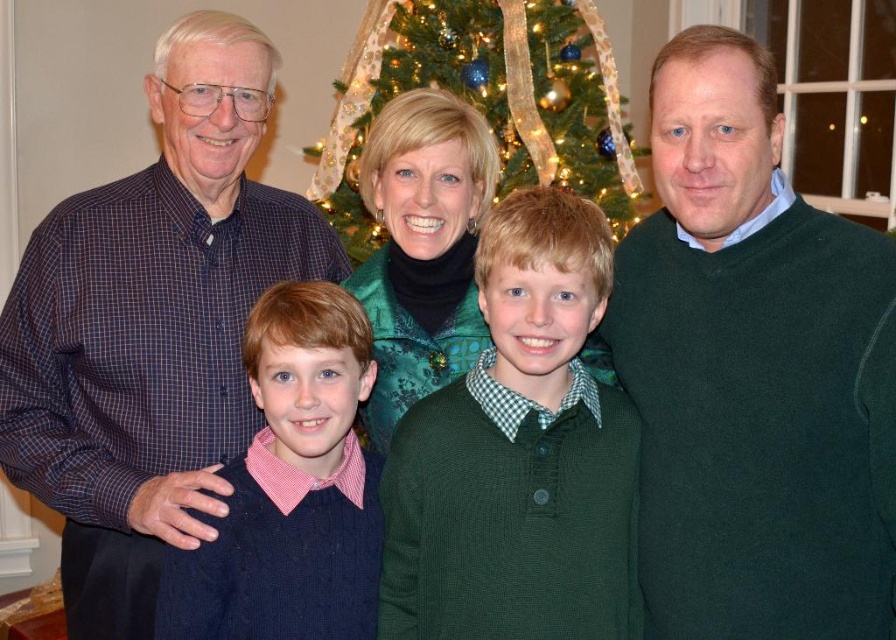
Image resolution: width=896 pixels, height=640 pixels. Describe the element at coordinates (519, 454) in the screenshot. I see `green knitted sweater at center` at that location.

Is green knitted sweater at center bigger than knitted dark blue sweater at center?

Yes, green knitted sweater at center is bigger than knitted dark blue sweater at center.

Find the location of `green knitted sweater at center`. green knitted sweater at center is located at coordinates (519, 454).

Can you confirm if green knitted sweater at center is bigger than green fabric christmas tree at center?

No, green knitted sweater at center is not bigger than green fabric christmas tree at center.

Is point (496, 385) more distant than point (574, 13)?

No, it is not.

The height and width of the screenshot is (640, 896). What do you see at coordinates (519, 454) in the screenshot?
I see `green knitted sweater at center` at bounding box center [519, 454].

Where is `green knitted sweater at center`? The width and height of the screenshot is (896, 640). green knitted sweater at center is located at coordinates (519, 454).

Between point (234, 307) and point (294, 381), which one is positioned in front?

Point (294, 381) is more forward.

Who is more forward, (148,189) or (334,317)?

Point (334,317) is in front.

Image resolution: width=896 pixels, height=640 pixels. What are the coordinates of `plaid shirt at left` in the screenshot? It's located at (151, 326).